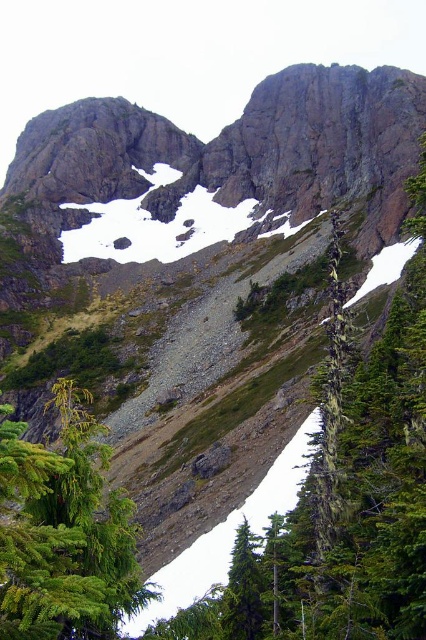
You are a hiker planning to climb the mountain. You see the green matte evergreen tree at lower left and the white powder snow at upper center. How far apart are these two landmarks?

The distance between the green matte evergreen tree at lower left and the white powder snow at upper center is 78.99 meters.

You are a hiker planning to set up a tent in this mountain area. You notice two trees in the foreground, the green matte evergreen tree at lower left and the green matte tree at lower center. Which tree would provide more shade if you set up your tent near it?

The green matte evergreen tree at lower left is much taller than the green matte tree at lower center, so it would provide more shade for your tent.